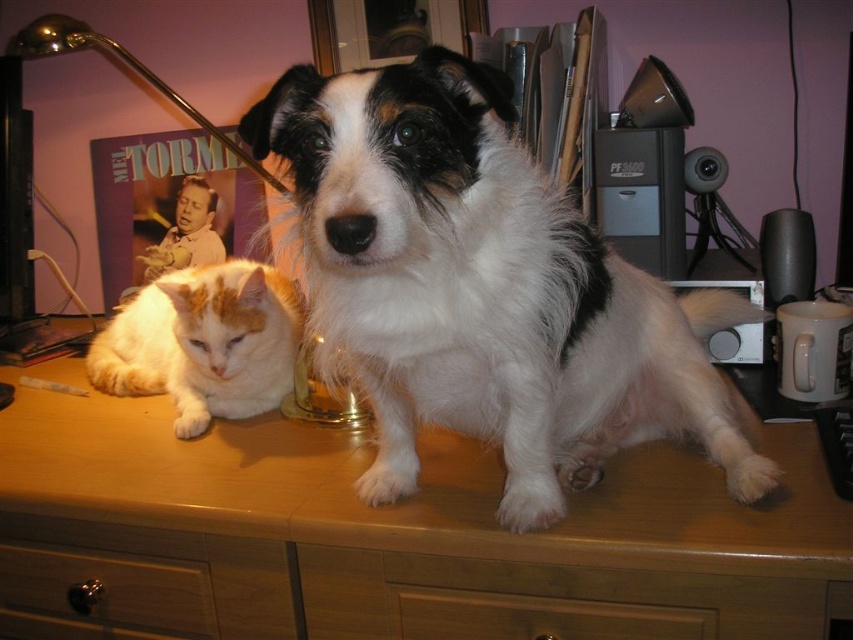
Identify the location of wooden at center. (393, 536).

Between wooden at center and orange-white fur cat at left, which one is positioned lower?

wooden at center

Describe the element at coordinates (393, 536) in the screenshot. I see `wooden at center` at that location.

In order to click on wooden at center in this screenshot , I will do `click(393, 536)`.

Does white fluffy dog at center appear on the right side of metallic brass drawer at lower left?

Yes, white fluffy dog at center is to the right of metallic brass drawer at lower left.

Is the position of white fluffy dog at center less distant than that of metallic brass drawer at lower left?

Yes, white fluffy dog at center is closer to the viewer.

Identify the location of white fluffy dog at center. (483, 289).

Is point (776, 449) positioned before point (70, 557)?

Yes, point (776, 449) is closer to viewer.

Who is more distant from viewer, (180, 497) or (22, 557)?

Point (22, 557)

Does point (120, 596) lie behind point (115, 589)?

No, (120, 596) is closer to viewer.

Find the location of a particular element. The width and height of the screenshot is (853, 640). wooden at center is located at coordinates (393, 536).